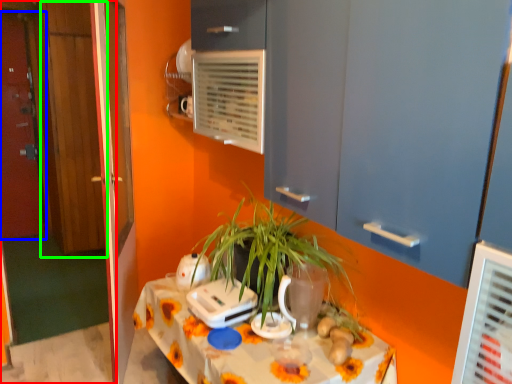
Question: Estimate the real-world distances between objects in this image. Which object is farther from door (highlighted by a red box), door (highlighted by a blue box) or door (highlighted by a green box)?

Choices:
 (A) door
 (B) door

Answer: (A)